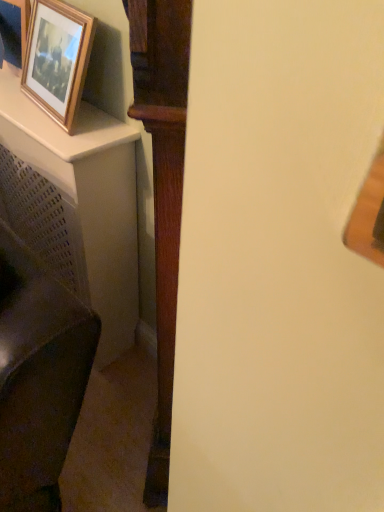
This screenshot has width=384, height=512. Identify the location of wooden picture frame at upper left. (57, 59).

What do you see at coordinates (57, 59) in the screenshot? I see `wooden picture frame at upper left` at bounding box center [57, 59].

This screenshot has width=384, height=512. What are the coordinates of `wooden picture frame at upper left` in the screenshot? It's located at (57, 59).